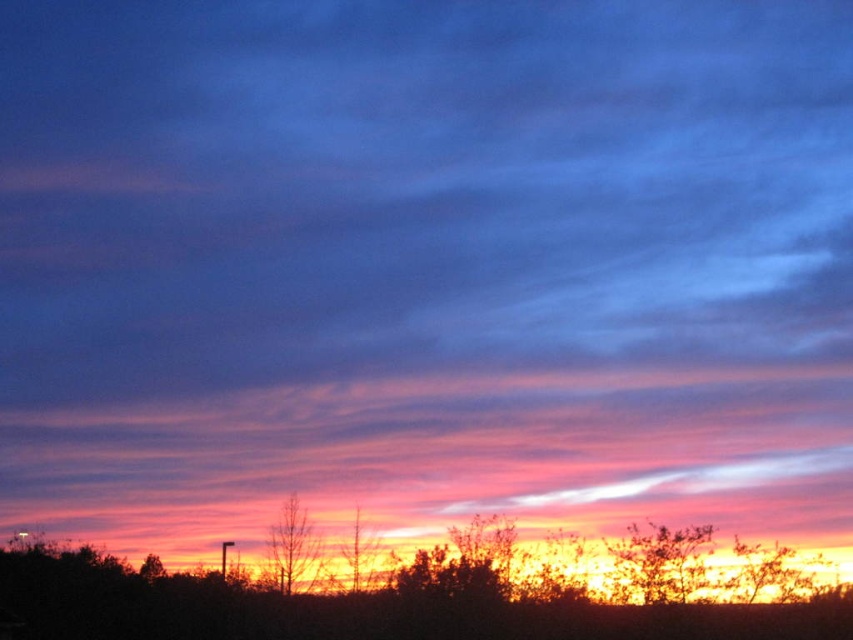
You are an artist trying to paint this sunset scene. You need to decide which object to paint first based on their sizes. Which object should you start with, the silhouette tree at lower center or the silhouette wood at center?

The silhouette tree at lower center has a larger width than the silhouette wood at center, so you should start painting the silhouette tree at lower center first to ensure proper scaling and positioning before moving to the smaller silhouette wood at center.

You are an artist trying to sketch the sunset scene. You notice the silhouette tree at lower center and the bare branches at center. Which object should you draw first if you want to follow the rule of drawing larger objects before smaller ones?

You should draw the silhouette tree at lower center first because it is larger in size than the bare branches at center.

In the sunset scene, there is a silhouette tree at lower center and bare branches at center. Which one has a greater width?

The silhouette tree at lower center has a greater width than the bare branches at center.